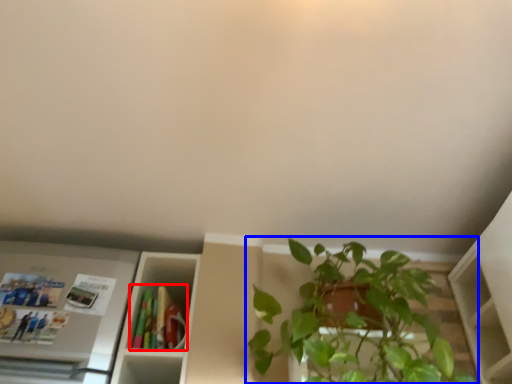
Question: Which object appears closest to the camera in this image, book (highlighted by a red box) or houseplant (highlighted by a blue box)?

Choices:
 (A) book
 (B) houseplant

Answer: (B)